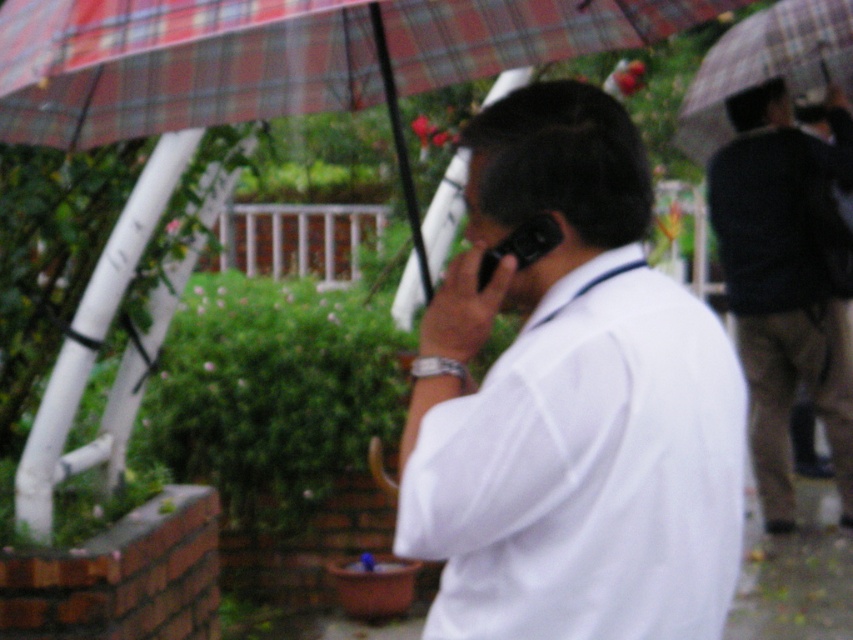
You are a photographer trying to capture a candid shot of the person talking on the phone. The plaid fabric umbrella at upper center and dark brown pants at right are in the frame. Which object is shorter in the image?

The plaid fabric umbrella at upper center has a lesser height compared to dark brown pants at right, so the plaid fabric umbrella at upper center is shorter in the image.

You are standing at the origin point in the image and want to walk towards the person holding the phone. Which point, point (737, 109) or point (535, 218), is closer to your path?

Point (535, 218) is closer to your path because it is in front of point (737, 109), which is behind it.